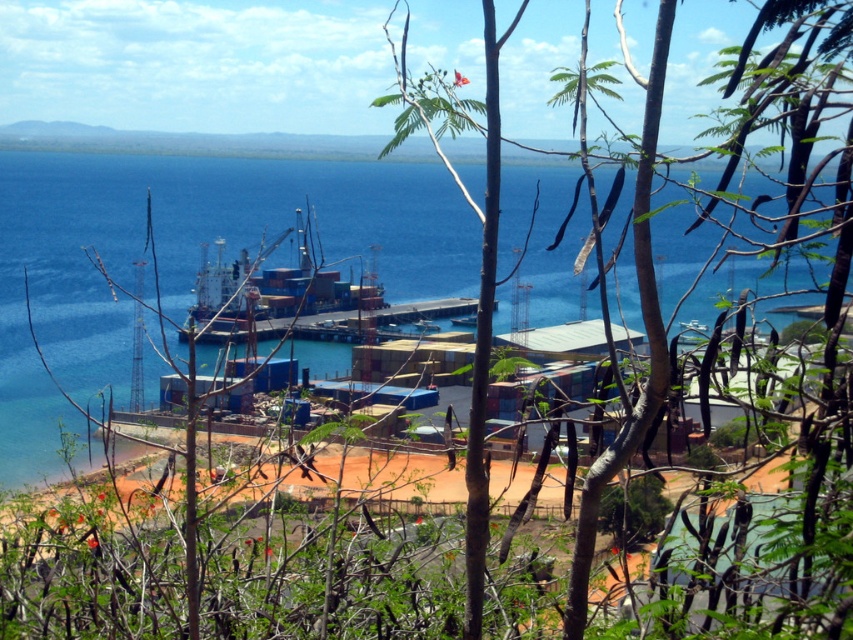
Question: Can you confirm if green leafy branches at center is positioned above blue water at center?

Choices:
 (A) yes
 (B) no

Answer: (B)

Question: Which point is closer to the camera?

Choices:
 (A) [x=703, y=180]
 (B) [x=809, y=579]

Answer: (B)

Question: Among these objects, which one is nearest to the camera?

Choices:
 (A) blue water at center
 (B) green leafy branches at center

Answer: (B)

Question: Considering the relative positions of green leafy branches at center and blue water at center in the image provided, where is green leafy branches at center located with respect to blue water at center?

Choices:
 (A) right
 (B) left

Answer: (A)

Question: Can you confirm if green leafy branches at center is positioned to the right of blue water at center?

Choices:
 (A) yes
 (B) no

Answer: (A)